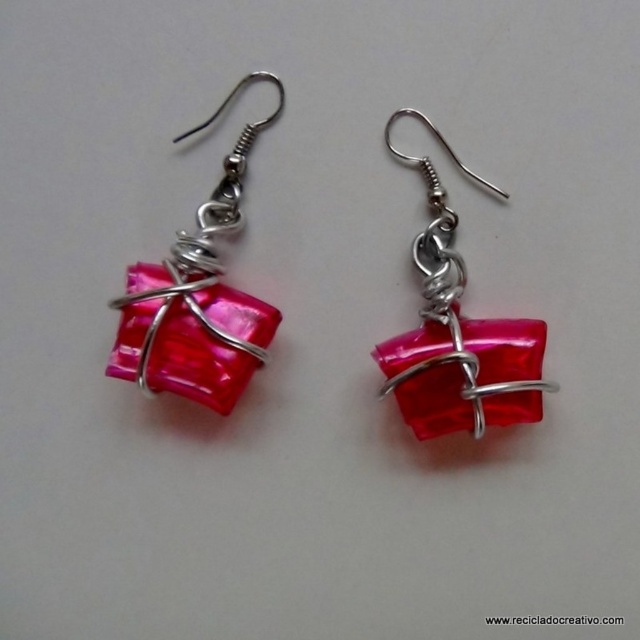
Looking at this image, you are an interior designer planning to place the pink glossy cube at center and the glossy red cube at center on a shelf. Based on the image, which cube is placed higher than the other?

The pink glossy cube at center is positioned over the glossy red cube at center, so it is placed higher.

Based on the photo, you are looking at an image of two cubes displayed on a plain white background. The cubes are labeled as the pink glossy cube at center and the glossy red cube at center. From your perspective, which cube appears nearer to you?

The pink glossy cube at center appears nearer to you because it is closer to the viewer than the glossy red cube at center.

You are a photographer trying to capture a closeup of the pink glossy cube at center. Your camera has a minimum focusing distance of 4 feet. Can you take a clear photo without moving the cube?

The pink glossy cube at center and camera are 4.29 feet apart, which is beyond the camera minimum focusing distance of 4 feet. So yes, you can take a clear photo without moving the cube.